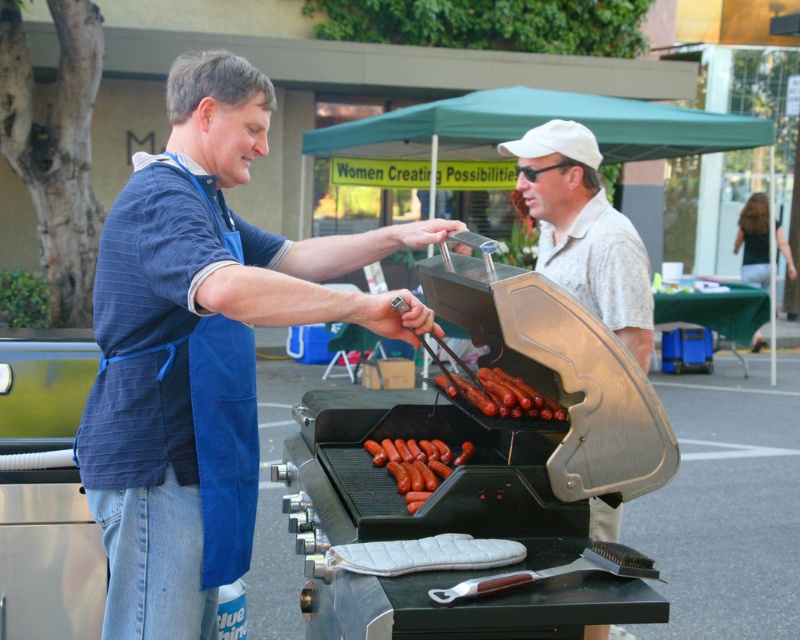
Question: Is white cap at upper center positioned before smooth brown sausages at center?

Choices:
 (A) no
 (B) yes

Answer: (A)

Question: Which point is closer to the camera?

Choices:
 (A) (546, 257)
 (B) (484, 406)
 (C) (385, 460)
 (D) (412, 324)

Answer: (D)

Question: Which of the following is the closest to the observer?

Choices:
 (A) shiny brown sausages at center
 (B) white cap at upper center
 (C) blue apron at left

Answer: (C)

Question: Can you confirm if white cap at upper center is positioned to the left of smooth brown sausages at center?

Choices:
 (A) no
 (B) yes

Answer: (A)

Question: Is blue apron at left thinner than smooth brown sausages at center?

Choices:
 (A) yes
 (B) no

Answer: (B)

Question: Which object is positioned farthest from the smooth brown sausages at center?

Choices:
 (A) shiny brown sausages at center
 (B) white cap at upper center

Answer: (B)